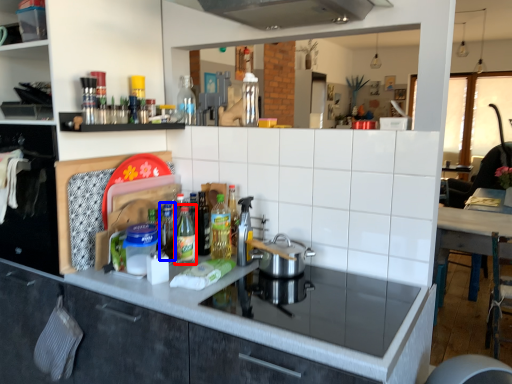
Question: Which point is closer to the camera, bottle (highlighted by a red box) or bottle (highlighted by a blue box)?

Choices:
 (A) bottle
 (B) bottle

Answer: (A)